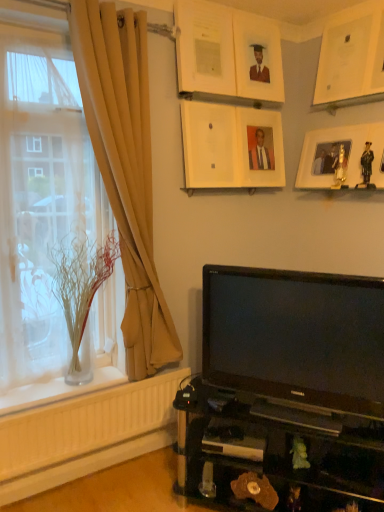
Question: Is beige fabric curtain at left closer to the viewer compared to matte wooden picture frame at upper center, which is the fourth picture frame in left-to-right order?

Choices:
 (A) no
 (B) yes

Answer: (B)

Question: Can you confirm if beige fabric curtain at left is thinner than matte wooden picture frame at upper center, which is the fourth picture frame in left-to-right order?

Choices:
 (A) no
 (B) yes

Answer: (A)

Question: From the image's perspective, is beige fabric curtain at left below matte wooden picture frame at upper center, positioned as the 3th picture frame in right-to-left order?

Choices:
 (A) yes
 (B) no

Answer: (A)

Question: Are beige fabric curtain at left and matte wooden picture frame at upper center, positioned as the 3th picture frame in right-to-left order, located far from each other?

Choices:
 (A) no
 (B) yes

Answer: (A)

Question: Considering the relative sizes of beige fabric curtain at left and matte wooden picture frame at upper center, positioned as the 3th picture frame in right-to-left order, in the image provided, is beige fabric curtain at left bigger than matte wooden picture frame at upper center, positioned as the 3th picture frame in right-to-left order,?

Choices:
 (A) no
 (B) yes

Answer: (B)

Question: Can you confirm if beige fabric curtain at left is shorter than matte wooden picture frame at upper center, which is the fourth picture frame in left-to-right order?

Choices:
 (A) yes
 (B) no

Answer: (B)

Question: Is the position of beige fabric curtain at left less distant than that of matte white picture frame at upper center, the 1th picture frame viewed from the left?

Choices:
 (A) no
 (B) yes

Answer: (B)

Question: Would you say beige fabric curtain at left is a long distance from matte white picture frame at upper center, which is counted as the sixth picture frame, starting from the right?

Choices:
 (A) no
 (B) yes

Answer: (A)

Question: Does beige fabric curtain at left turn towards matte white picture frame at upper center, the 1th picture frame viewed from the left?

Choices:
 (A) yes
 (B) no

Answer: (B)

Question: Is beige fabric curtain at left bigger than matte white picture frame at upper center, the 1th picture frame viewed from the left?

Choices:
 (A) no
 (B) yes

Answer: (B)

Question: From a real-world perspective, is beige fabric curtain at left over matte white picture frame at upper center, which is counted as the sixth picture frame, starting from the right?

Choices:
 (A) no
 (B) yes

Answer: (A)

Question: From a real-world perspective, is beige fabric curtain at left located beneath matte white picture frame at upper center, the 1th picture frame viewed from the left?

Choices:
 (A) no
 (B) yes

Answer: (B)

Question: From a real-world perspective, is beige fabric curtain at left positioned over clear glass vase at left based on gravity?

Choices:
 (A) yes
 (B) no

Answer: (A)